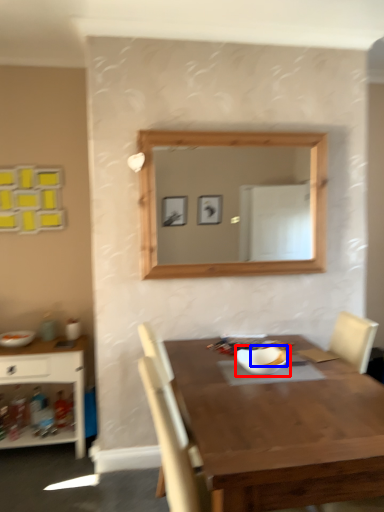
Question: Which object is further to the camera taking this photo, bowl (highlighted by a red box) or food (highlighted by a blue box)?

Choices:
 (A) bowl
 (B) food

Answer: (B)